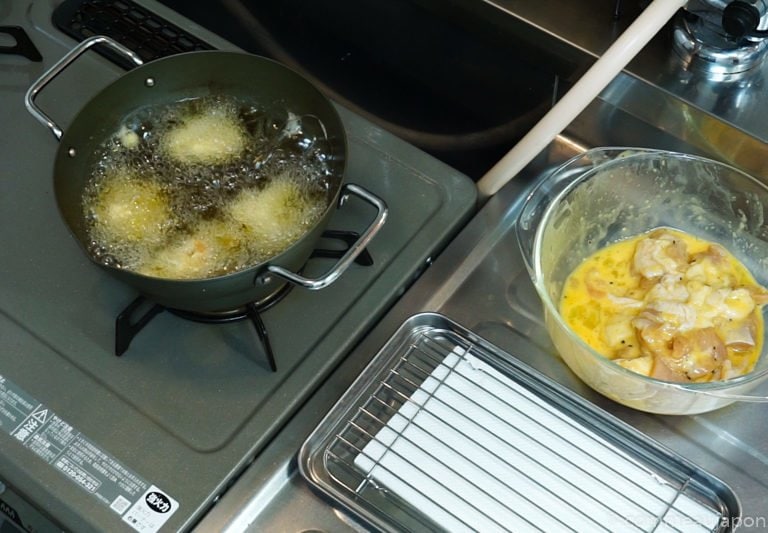
In order to click on clear glass bowl handle in this screenshot , I will do `click(557, 185)`, `click(759, 389)`.